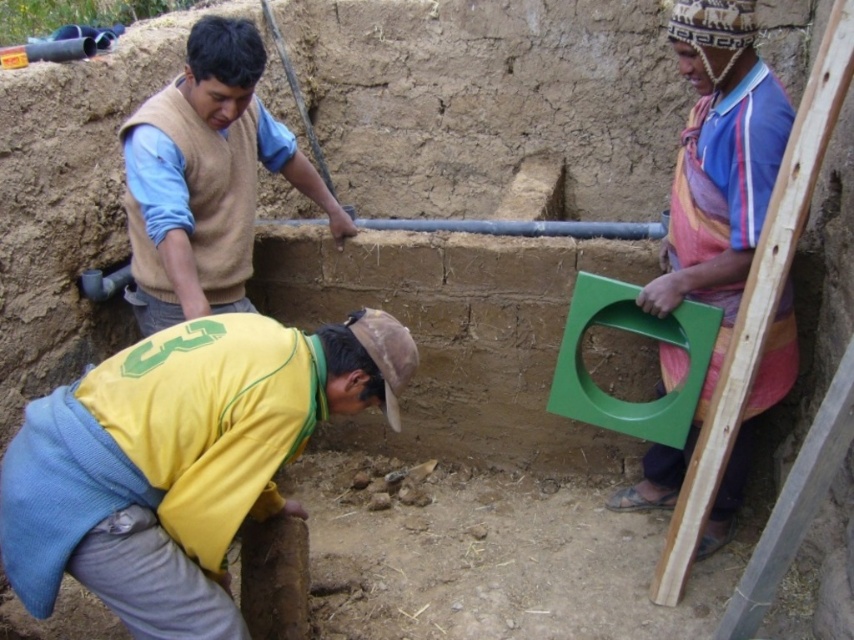
Is yellow fabric at lower center below green plastic frame at right?

Correct, yellow fabric at lower center is located below green plastic frame at right.

Which of these two, yellow fabric at lower center or green plastic frame at right, stands shorter?

With less height is yellow fabric at lower center.

Identify the location of yellow fabric at lower center. (179, 460).

Is yellow fabric at lower center to the left of beige wool sweater at upper left from the viewer's perspective?

Incorrect, yellow fabric at lower center is not on the left side of beige wool sweater at upper left.

Which of these two, yellow fabric at lower center or beige wool sweater at upper left, stands taller?

Standing taller between the two is beige wool sweater at upper left.

In order to click on yellow fabric at lower center in this screenshot , I will do `click(179, 460)`.

Is point (677, 264) less distant than point (219, 161)?

No, it is behind (219, 161).

Can you confirm if green plastic frame at right is positioned to the right of beige wool sweater at upper left?

Correct, you'll find green plastic frame at right to the right of beige wool sweater at upper left.

Between point (711, 532) and point (354, 228), which one is positioned in front?

Point (711, 532) is in front.

At what (x,y) coordinates should I click in order to perform the action: click on green plastic frame at right. Please return your answer as a coordinate pair (x, y). Looking at the image, I should click on (712, 196).